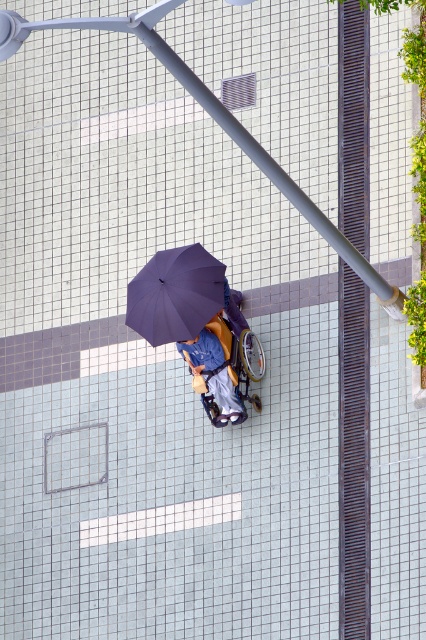
You are standing 60 meters away from the purple matte umbrella at center. Can you reach it without moving closer?

The purple matte umbrella at center is 63.30 meters away from the viewer, so you are still 3.3 meters away and cannot reach it without moving closer.

You are a person in a wheelchair positioned at the center of the image. You want to move forward to reach the vertical drainage grate on the right. There are two umbrellas at your current position. Which umbrella, the purple matte umbrella at center or the blue fabric umbrella at center, would you need to move to make space for your wheelchair?

The purple matte umbrella at center has a lesser height compared to the blue fabric umbrella at center, so you should move the purple matte umbrella at center to make space for your wheelchair since it is shorter and less likely to obstruct the path.